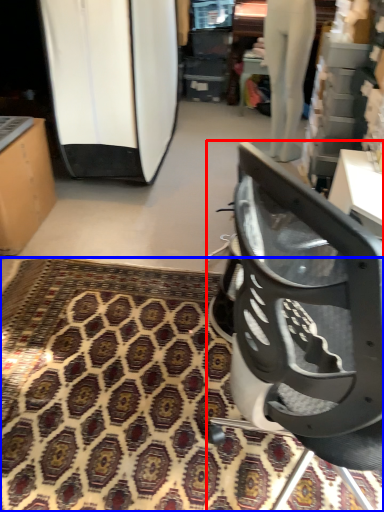
Question: Which of the following is the farthest to the observer, chair (highlighted by a red box) or mat (highlighted by a blue box)?

Choices:
 (A) chair
 (B) mat

Answer: (B)